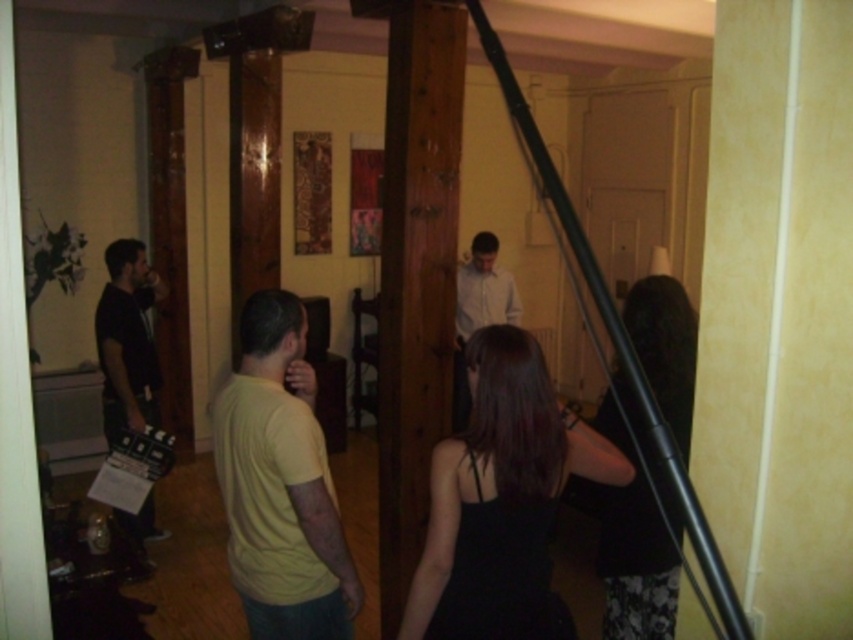
Who is positioned more to the right, yellow matte shirt at center or white matte shirt at center?

From the viewer's perspective, white matte shirt at center appears more on the right side.

Based on the photo, measure the distance from yellow matte shirt at center to white matte shirt at center.

yellow matte shirt at center is 9.64 feet from white matte shirt at center.

Is point (310, 470) closer to camera compared to point (457, 337)?

Yes, point (310, 470) is closer to viewer.

Where is `yellow matte shirt at center`? yellow matte shirt at center is located at coordinates (280, 483).

Between black satin dress at center and white matte shirt at center, which one appears on the right side from the viewer's perspective?

white matte shirt at center

Is black satin dress at center positioned in front of white matte shirt at center?

Yes, it is in front of white matte shirt at center.

Locate an element on the screen. The image size is (853, 640). black satin dress at center is located at coordinates click(500, 497).

Is black matte dress at lower right to the right of matte black clapperboard at left from the viewer's perspective?

Correct, you'll find black matte dress at lower right to the right of matte black clapperboard at left.

Who is more distant from viewer, (635, 577) or (135, 355)?

The point (135, 355) is behind.

Between point (630, 573) and point (149, 403), which one is positioned behind?

Positioned behind is point (149, 403).

Image resolution: width=853 pixels, height=640 pixels. What are the coordinates of `black matte dress at lower right` in the screenshot? It's located at (633, 548).